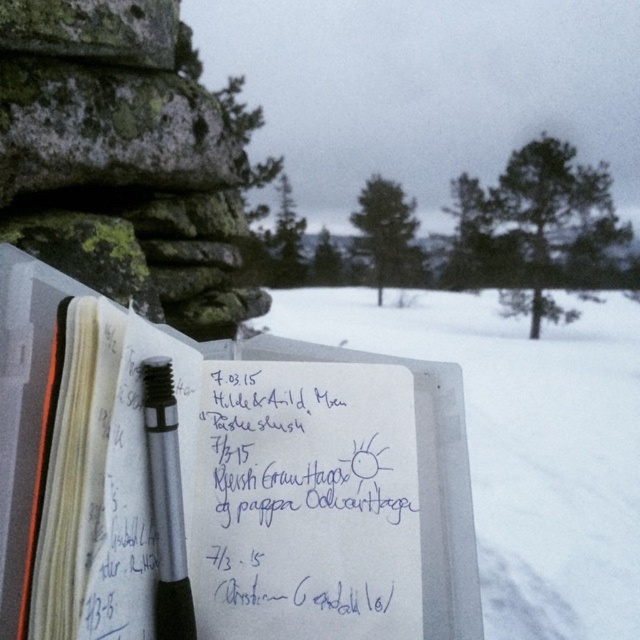
Is white paper at center behind silver metallic pen at center?

Yes.

Between white paper at center and silver metallic pen at center, which one appears on the left side from the viewer's perspective?

From the viewer's perspective, silver metallic pen at center appears more on the left side.

Does point (534, 440) come closer to viewer compared to point (172, 484)?

No, it is behind (172, 484).

Identify the location of white paper at center. Image resolution: width=640 pixels, height=640 pixels. (524, 444).

Does blue ink writing at center appear on the right side of silver metallic pen at center?

Indeed, blue ink writing at center is positioned on the right side of silver metallic pen at center.

Is blue ink writing at center below silver metallic pen at center?

Yes, blue ink writing at center is below silver metallic pen at center.

Which is behind, point (296, 630) or point (160, 364)?

The point (296, 630) is more distant.

I want to click on blue ink writing at center, so click(x=307, y=500).

Who is more distant from viewer, (330,337) or (260,529)?

The point (330,337) is behind.

Which is below, white paper at center or blue ink writing at center?

Positioned lower is blue ink writing at center.

Does point (632, 396) lie in front of point (412, 525)?

No, it is not.

Identify the location of white paper at center. click(x=524, y=444).